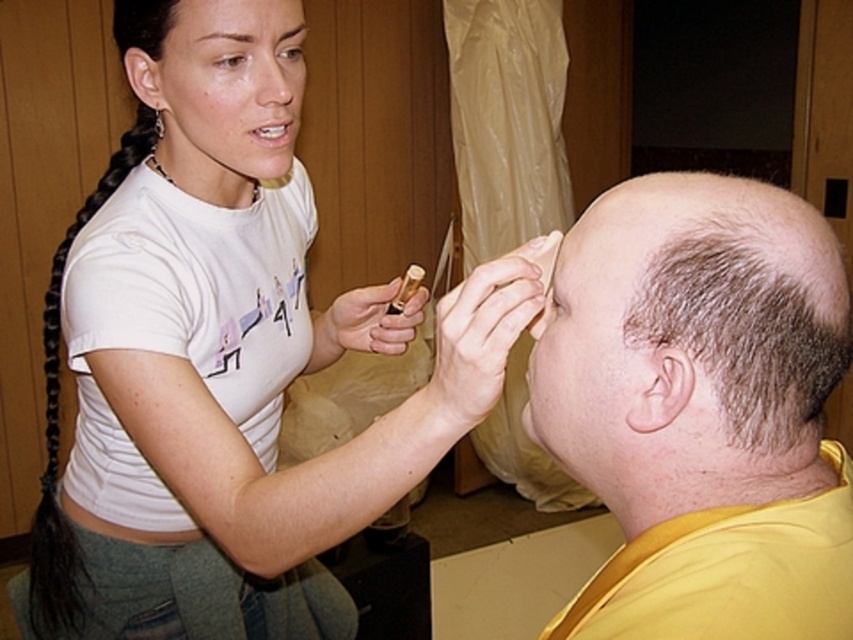
Does point (195, 310) come closer to viewer compared to point (67, 534)?

Yes, point (195, 310) is in front of point (67, 534).

Who is more distant from viewer, (132, 321) or (113, 180)?

The point (113, 180) is more distant.

Does point (16, 614) come behind point (42, 636)?

Yes, it is behind point (42, 636).

What are the coordinates of `white matte t-shirt at upper left` in the screenshot? It's located at [223, 360].

Is point (614, 570) positioned behind point (192, 33)?

No.

In the scene shown: Is bald head at upper right behind dark brown hair at upper center?

No.

At what (x,y) coordinates should I click in order to perform the action: click on bald head at upper right. Please return your answer as a coordinate pair (x, y). The image size is (853, 640). Looking at the image, I should click on [x=701, y=410].

Is gray hair at upper center thinner than dark brown hair at upper center?

No.

Is point (722, 323) positioned behind point (192, 36)?

No, it is not.

Identify the location of gray hair at upper center. tap(750, 326).

Locate an element on the screen. gray hair at upper center is located at coordinates (750, 326).